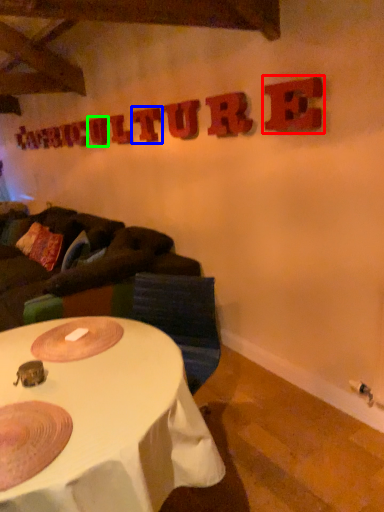
Question: Considering the real-world distances, which object is farthest from letter (highlighted by a red box)? letter (highlighted by a blue box) or letter (highlighted by a green box)?

Choices:
 (A) letter
 (B) letter

Answer: (B)